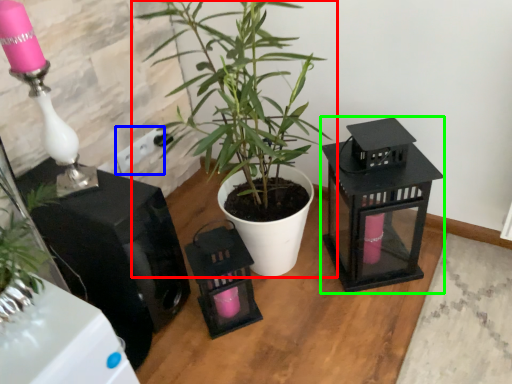
Question: Estimate the real-world distances between objects in this image. Which object is closer to houseplant (highlighted by a red box), electric outlet (highlighted by a blue box) or appliance (highlighted by a green box)?

Choices:
 (A) electric outlet
 (B) appliance

Answer: (B)